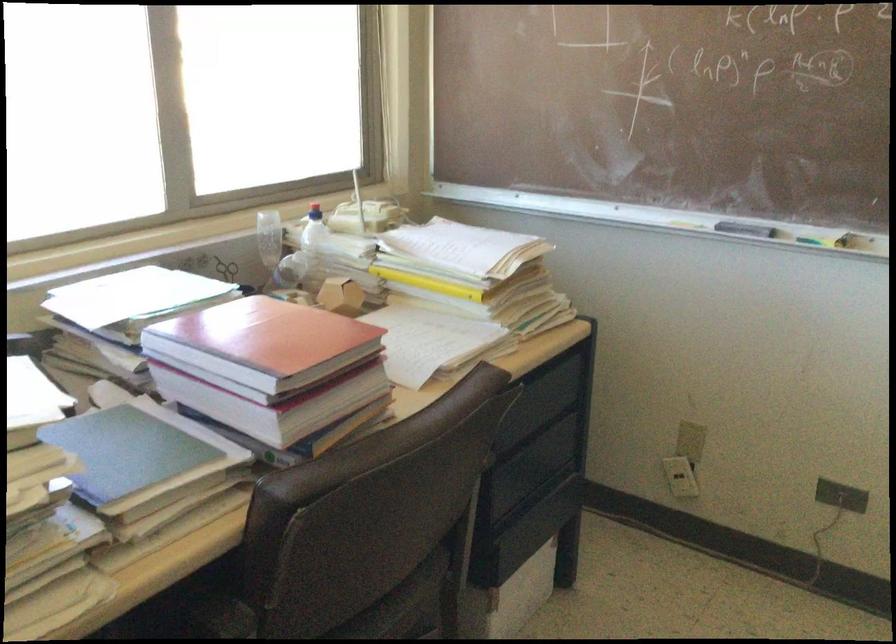
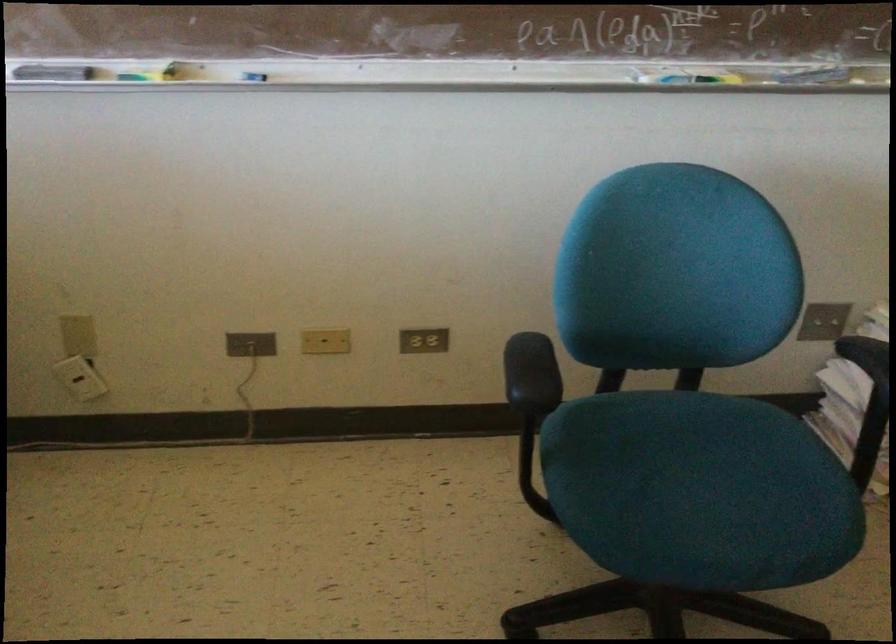
First-person continuous shooting, in which direction is the camera rotating?

The camera rotated toward right-down.